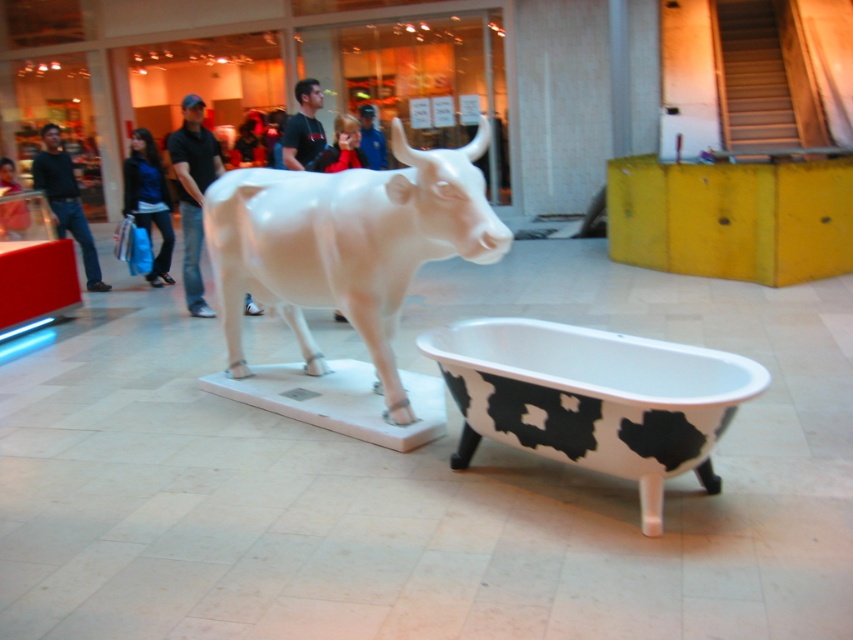
Question: Which of the following is the closest to the observer?

Choices:
 (A) (250, 204)
 (B) (61, 205)

Answer: (A)

Question: Which object is the farthest from the blue fabric jacket at center?

Choices:
 (A) white glossy bull at center
 (B) matte black shirt at center
 (C) black cotton shirt at center

Answer: (A)

Question: Is matte black jacket at left thinner than black jeans at left?

Choices:
 (A) yes
 (B) no

Answer: (A)

Question: Is matte black jacket at left closer to the viewer compared to black jeans at left?

Choices:
 (A) yes
 (B) no

Answer: (B)

Question: Which object appears farthest from the camera in this image?

Choices:
 (A) white glossy bull at center
 (B) matte black jacket at left

Answer: (B)

Question: Can you confirm if black cotton shirt at center is bigger than matte black jacket at upper left?

Choices:
 (A) no
 (B) yes

Answer: (B)